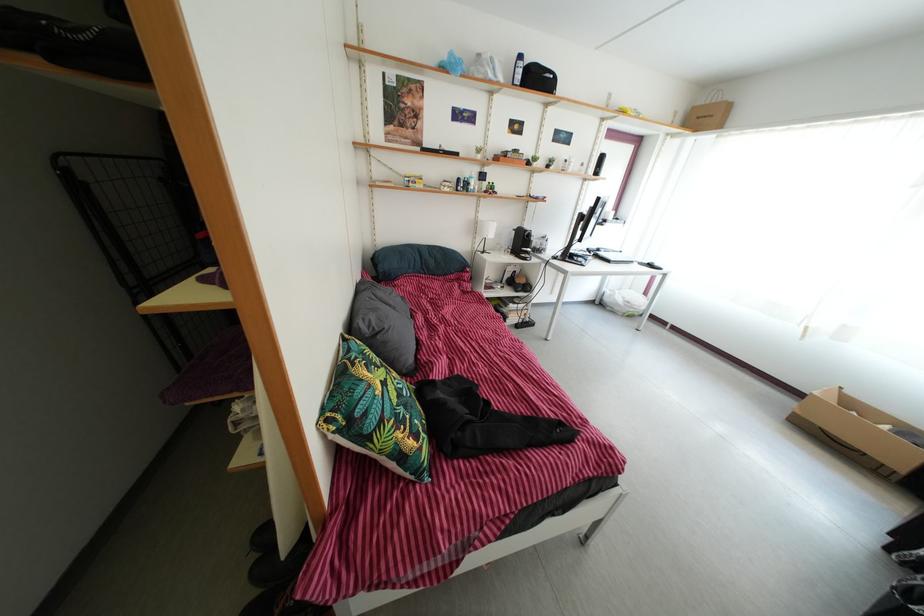
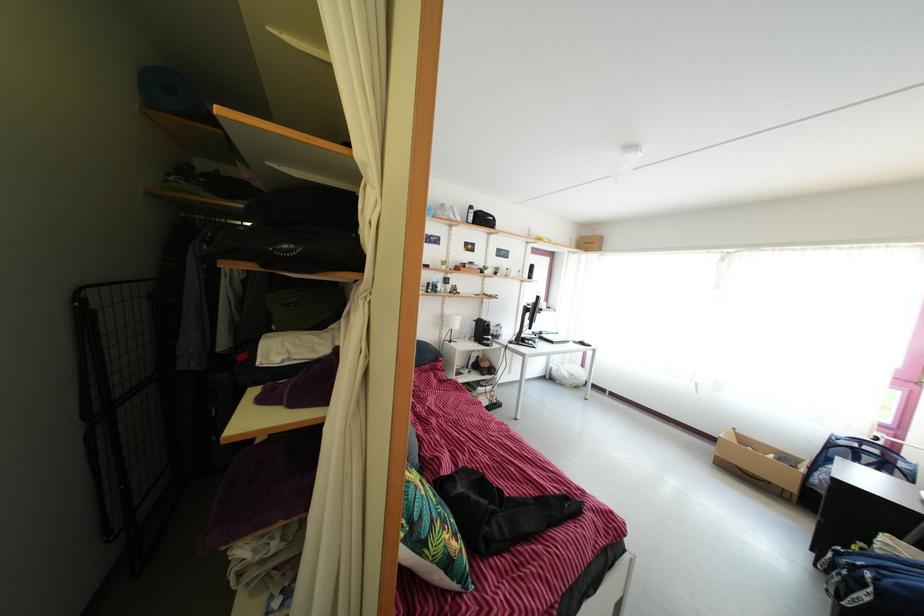
Where in the second image is the point corresponding to pixel 483 220 from the first image?

(448, 315)